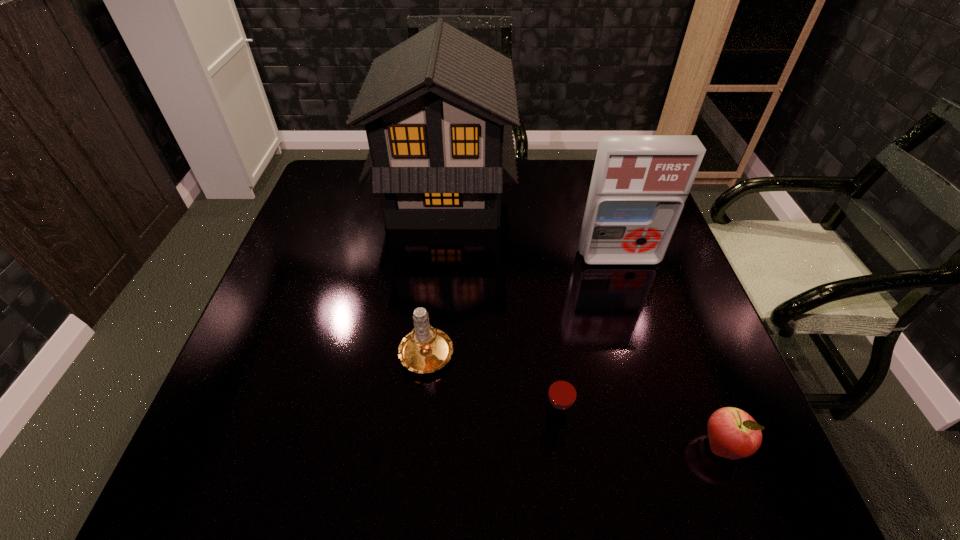
This screenshot has width=960, height=540. Identify the location of vacant space located 0.070m on the left of the third shortest object. (366, 349).

The height and width of the screenshot is (540, 960). Find the location of `free space located on the left of the glass`. free space located on the left of the glass is located at coordinates click(324, 420).

Where is `vacant region located on the back of the apple`? This screenshot has height=540, width=960. vacant region located on the back of the apple is located at coordinates (704, 399).

Locate an element on the screen. object that is at the far edge is located at coordinates [x=438, y=109].

The image size is (960, 540). In order to click on object that is at the near edge in this screenshot , I will do `click(733, 434)`.

Locate an element on the screen. This screenshot has height=540, width=960. the first-aid kit positioned at the right edge is located at coordinates (639, 185).

At what (x,y) coordinates should I click in order to perform the action: click on apple located in the right edge section of the desktop. Please return your answer as a coordinate pair (x, y). The image size is (960, 540). Looking at the image, I should click on pos(733,434).

Find the location of a particular element. object that is at the near right corner is located at coordinates (733, 434).

Locate an element on the screen. The width and height of the screenshot is (960, 540). blank area at the far edge is located at coordinates (573, 165).

I want to click on blank area at the near edge, so click(x=564, y=463).